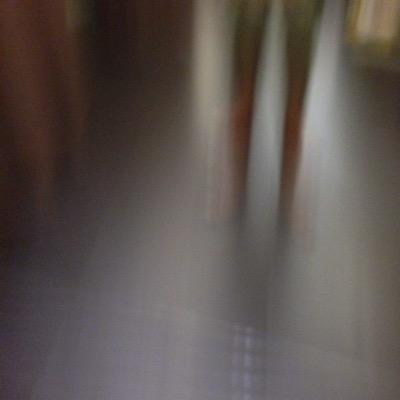
The image size is (400, 400). What are the coordinates of `possibly a window` in the screenshot? It's located at (357, 30).